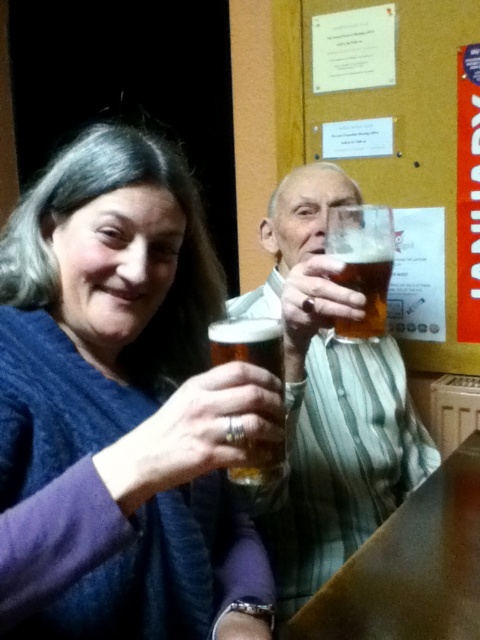
You are a bartender who needs to place a coaster between the two glasses to prevent condensation damage. The coaster you have is 30 centimeters in diameter. Can you fit it between the translucent glass at center and the translucent glass beer at center without overlapping either?

The distance between the translucent glass at center and the translucent glass beer at center is 36.44 centimeters. Since the coaster is 30 centimeters in diameter, which is smaller than the distance between them, you can place it between them without overlapping either.

You are a bartender preparing drinks for the two people in the image. You need to place a new drink between the matte blue sweater at upper left and the translucent glass at upper center. Where should you place it to ensure it is between them?

The new drink should be placed between the matte blue sweater at upper left and the translucent glass at upper center. Since the matte blue sweater at upper left is below the translucent glass at upper center, the drink should be placed above the matte blue sweater at upper left and below the translucent glass at upper center to be between them.

You are a bartender who needs to place a 12 inch long bottle between the translucent glass at center and the translucent glass at upper center. Can you fit it there?

The distance between the translucent glass at center and the translucent glass at upper center is 11.52 inches, which is slightly shorter than the 12 inch bottle. Therefore, the bottle cannot fit in that space.